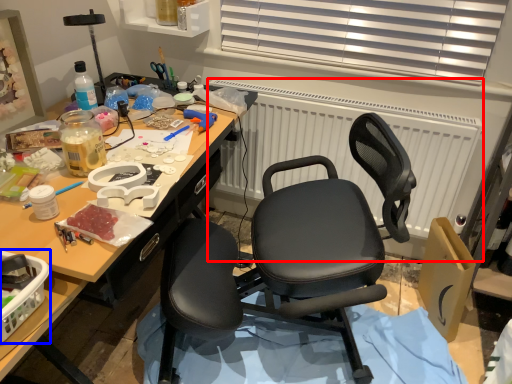
Question: Among these objects, which one is nearest to the camera, radiator (highlighted by a red box) or box (highlighted by a blue box)?

Choices:
 (A) radiator
 (B) box

Answer: (B)